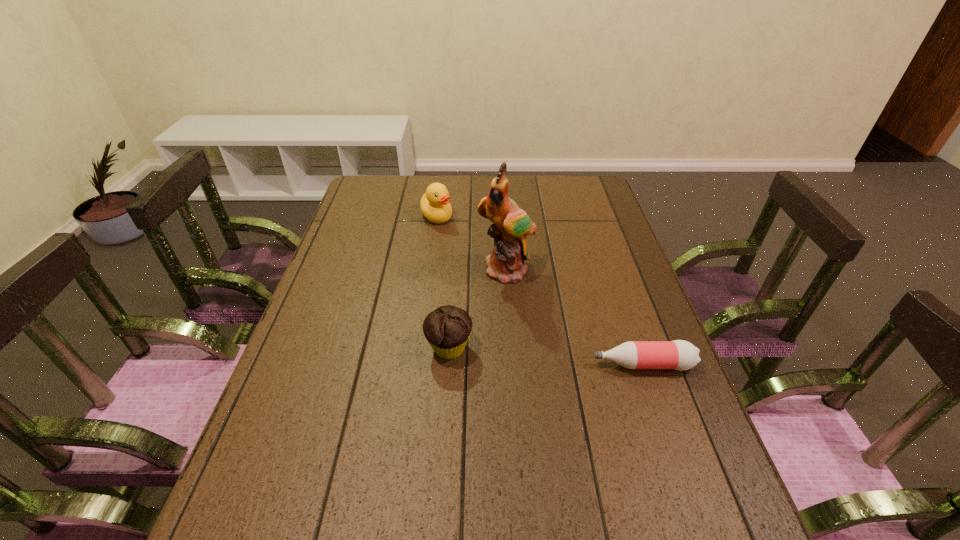
This screenshot has width=960, height=540. Find the location of `free space on the desktop that is between the muffin and the rightmost object and is positioned at the beak of the farthest object`. free space on the desktop that is between the muffin and the rightmost object and is positioned at the beak of the farthest object is located at coordinates coord(546,356).

Find the location of a particular element. The height and width of the screenshot is (540, 960). free spot on the desktop that is between the muffin and the shortest object and is positioned on the front-facing side of the parrot is located at coordinates (529, 355).